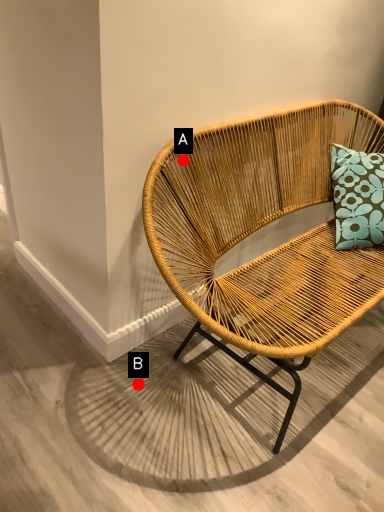
Question: Two points are circled on the image, labeled by A and B beside each circle. Which of the following is the farthest from the observer?

Choices:
 (A) A is further
 (B) B is further

Answer: (B)